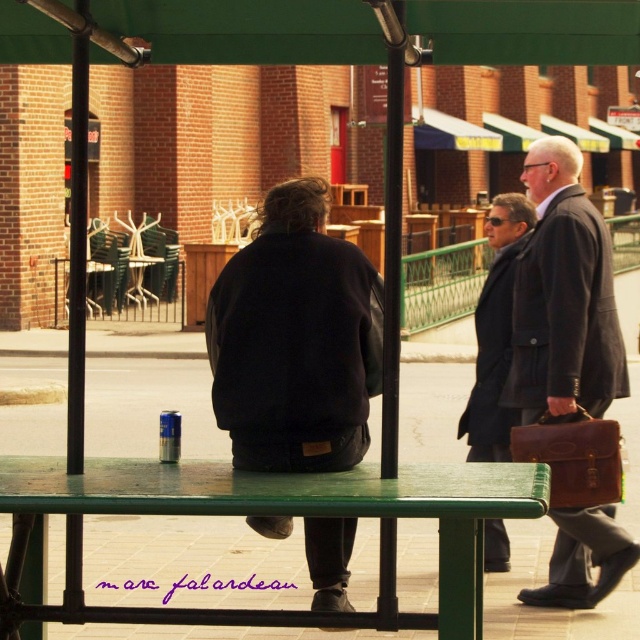
Does green painted wood picnic table at lower center appear on the left side of dark wool coat at center?

Correct, you'll find green painted wood picnic table at lower center to the left of dark wool coat at center.

Does green painted wood picnic table at lower center have a larger size compared to dark wool coat at center?

No.

The image size is (640, 640). Find the location of `green painted wood picnic table at lower center`. green painted wood picnic table at lower center is located at coordinates (273, 513).

Which of these two, dark brown leather briefcase at right or brown leather briefcase at right, stands shorter?

brown leather briefcase at right

Who is positioned more to the right, dark brown leather briefcase at right or brown leather briefcase at right?

dark brown leather briefcase at right

Find the location of `dark brown leather briefcase at right`. dark brown leather briefcase at right is located at coordinates (563, 298).

Is point (364, 420) farther from viewer compared to point (515, 433)?

No, it is in front of (515, 433).

Is black leather jacket at center positioned behind brown leather briefcase at right?

No, it is in front of brown leather briefcase at right.

The image size is (640, 640). What do you see at coordinates (296, 340) in the screenshot? I see `black leather jacket at center` at bounding box center [296, 340].

In order to click on black leather jacket at center in this screenshot , I will do `click(296, 340)`.